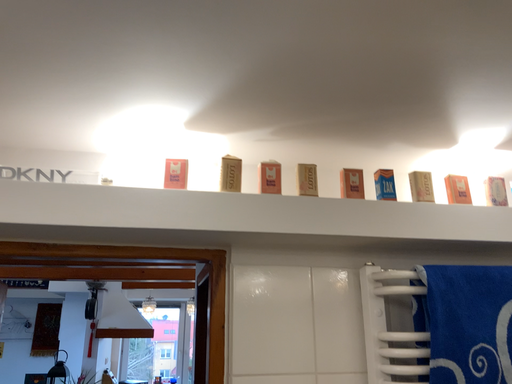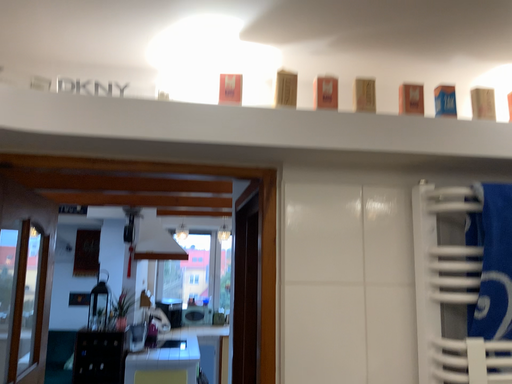
Question: How did the camera likely rotate when shooting the video?

Choices:
 (A) rotated upward
 (B) rotated downward

Answer: (B)